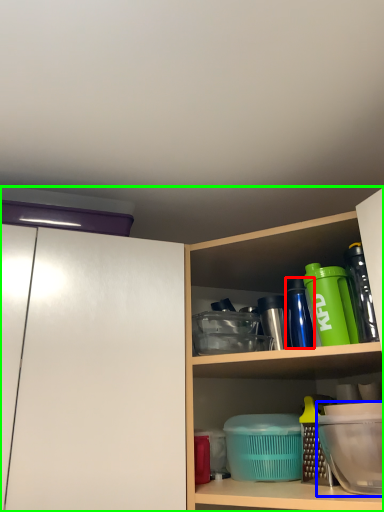
Question: Which object is the farthest from bottle (highlighted by a red box)? Choose among these: appliance (highlighted by a blue box) or cabinetry (highlighted by a green box).

Choices:
 (A) appliance
 (B) cabinetry

Answer: (B)